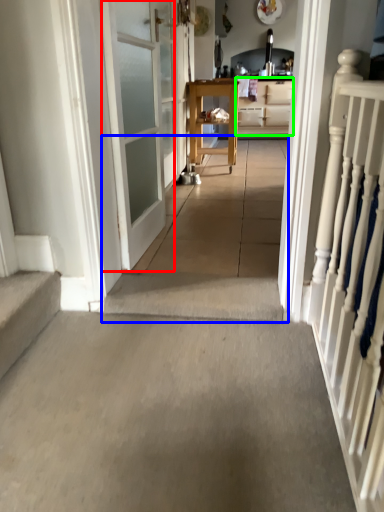
Question: Which object is the closest to the door (highlighted by a red box)? Choose among these: path (highlighted by a blue box) or cabinetry (highlighted by a green box).

Choices:
 (A) path
 (B) cabinetry

Answer: (A)